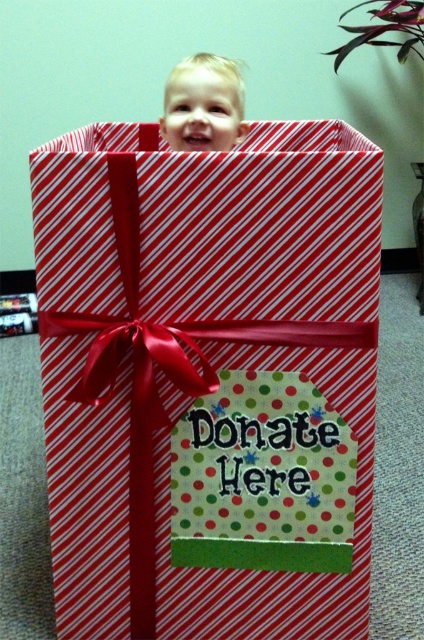
Question: Which of the following is the farthest from the observer?

Choices:
 (A) (220, 596)
 (B) (186, 116)

Answer: (B)

Question: Does red striped gift box at center have a larger size compared to blonde hair toddler at upper center?

Choices:
 (A) no
 (B) yes

Answer: (B)

Question: Does red striped gift box at center have a larger size compared to blonde hair toddler at upper center?

Choices:
 (A) no
 (B) yes

Answer: (B)

Question: Can you confirm if red striped gift box at center is bigger than blonde hair toddler at upper center?

Choices:
 (A) no
 (B) yes

Answer: (B)

Question: Which point is farther from the camera taking this photo?

Choices:
 (A) [236, 83]
 (B) [55, 584]

Answer: (A)